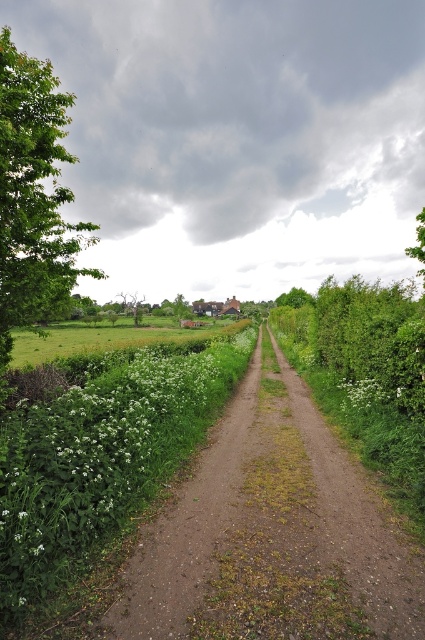
You are standing at the point marked as point (34,196) in the image. What is the nearest object to you in the scene?

The nearest object to you at point (34,196) is the green leafy tree at left, as the point is located on it.

You are a hiker standing at the start of the dirt path at center. You want to reach the traditional house in the background. Which direction should you walk relative to the green leafy tree at left?

The dirt path at center is in front of the green leafy tree at left, so you should walk forward along the dirt path at center away from the green leafy tree at left to reach the traditional house in the background.

In the scene shown: You are a hiker standing on the dirt path and want to take a photo of the green leafy tree at left and the green grassy field at center. Which object should you point your camera upwards to capture?

You should point your camera upwards to capture the green leafy tree at left because it is above the green grassy field at center.